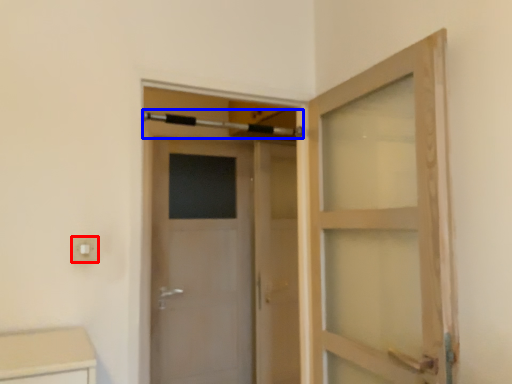
Question: Among these objects, which one is nearest to the camera, electric outlet (highlighted by a red box) or towel bar (highlighted by a blue box)?

Choices:
 (A) electric outlet
 (B) towel bar

Answer: (A)